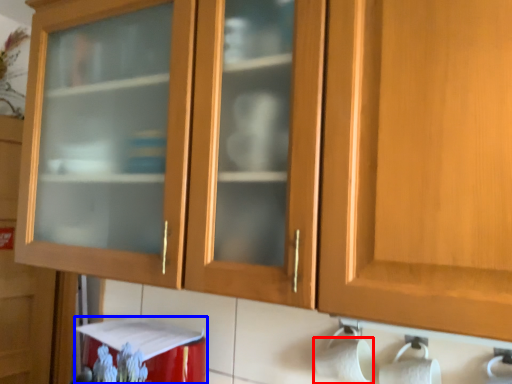
Question: Among these objects, which one is nearest to the camera, toilet paper (highlighted by a red box) or appliance (highlighted by a blue box)?

Choices:
 (A) toilet paper
 (B) appliance

Answer: (A)